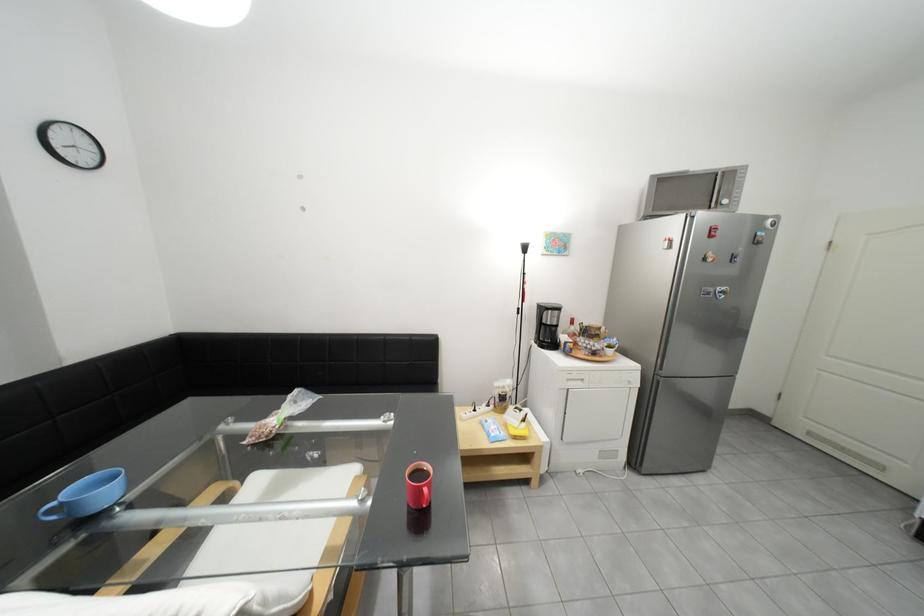
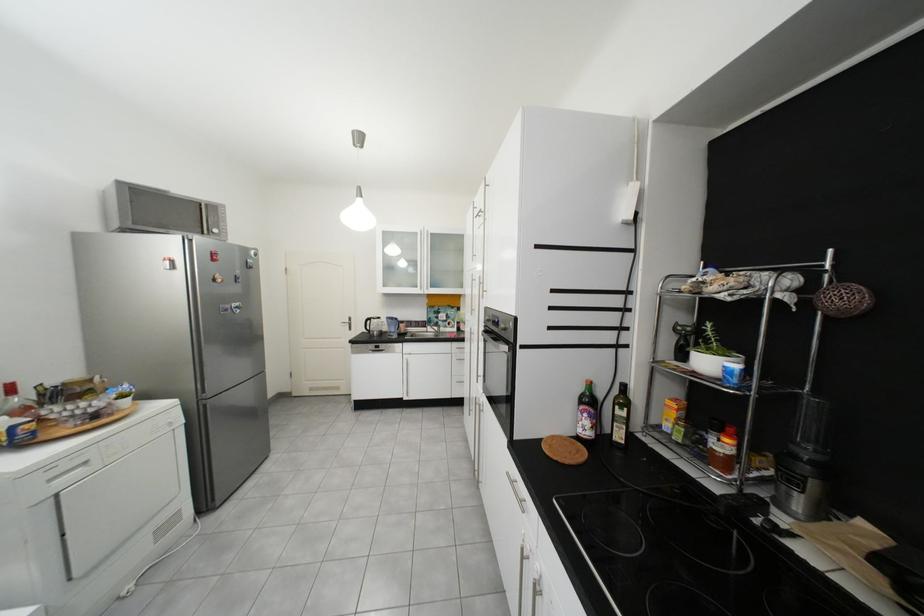
Find the pixel in the second image that matches [720,294] in the first image.

(237, 310)